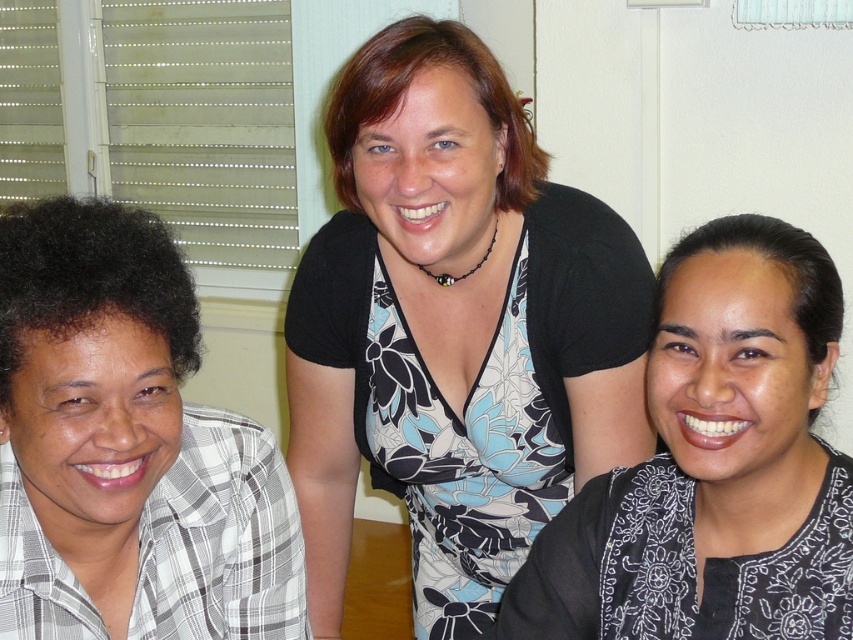
Question: Considering the real-world distances, which object is farthest from the floral dress at center?

Choices:
 (A) white checkered shirt at left
 (B) black floral dress at center

Answer: (A)

Question: Which object is closer to the camera taking this photo?

Choices:
 (A) floral dress at center
 (B) white checkered shirt at left
 (C) black floral dress at center

Answer: (B)

Question: From the image, what is the correct spatial relationship of floral dress at center in relation to white checkered shirt at left?

Choices:
 (A) left
 (B) right

Answer: (B)

Question: Which object is the closest to the black floral dress at center?

Choices:
 (A) white checkered shirt at left
 (B) floral dress at center

Answer: (B)

Question: Does white checkered shirt at left appear on the left side of black floral dress at center?

Choices:
 (A) no
 (B) yes

Answer: (B)

Question: Considering the relative positions of floral dress at center and white checkered shirt at left in the image provided, where is floral dress at center located with respect to white checkered shirt at left?

Choices:
 (A) above
 (B) below

Answer: (A)